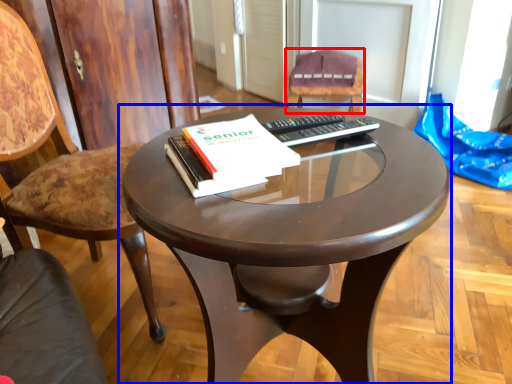
Question: Which object is further to the camera taking this photo, chair (highlighted by a red box) or coffee table (highlighted by a blue box)?

Choices:
 (A) chair
 (B) coffee table

Answer: (A)